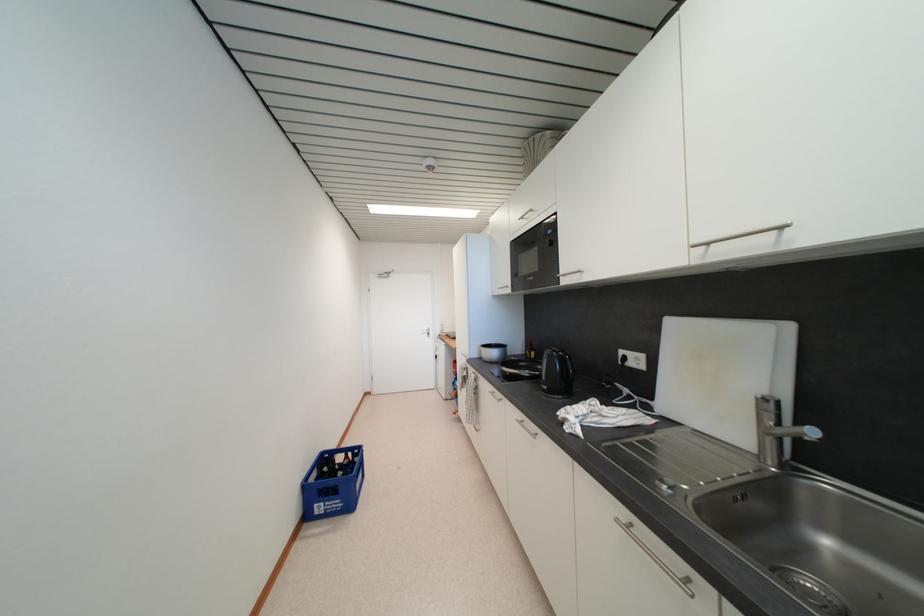
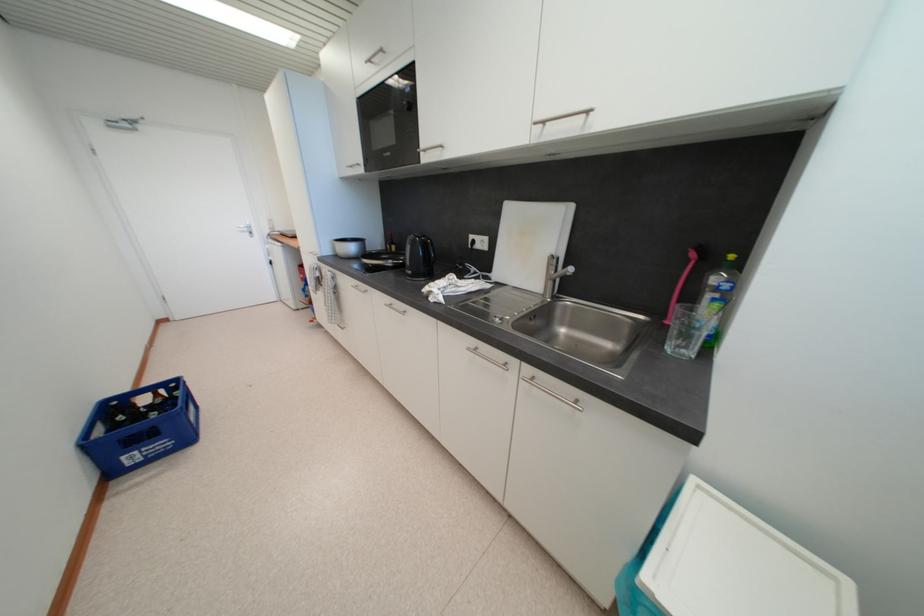
Find the pixel in the second image that matches point (532, 374) in the first image.

(395, 264)